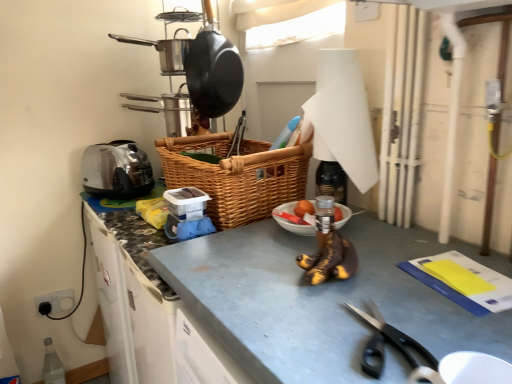
Identify the location of free spot above smooth gray countertop at center (from a real-world perspective). The image size is (512, 384). (389, 287).